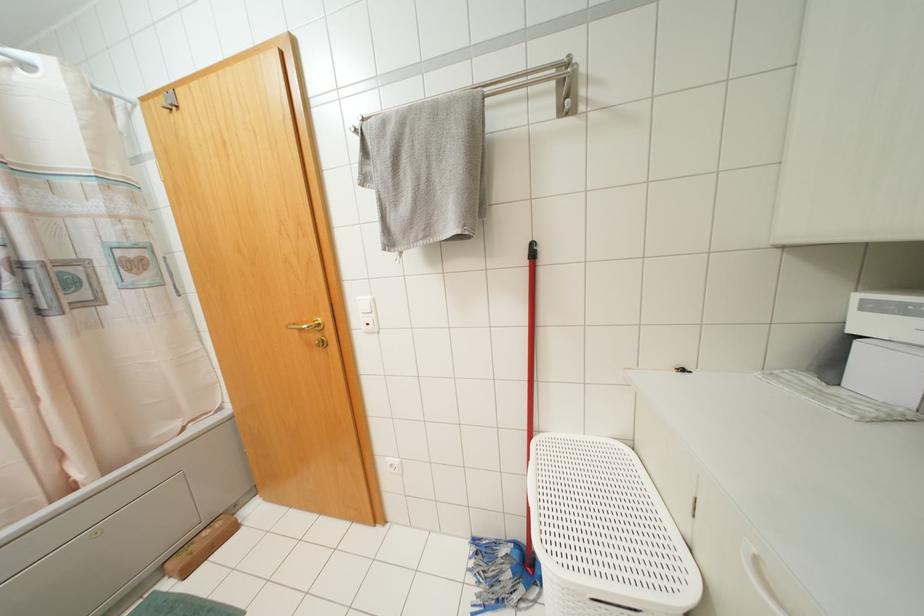
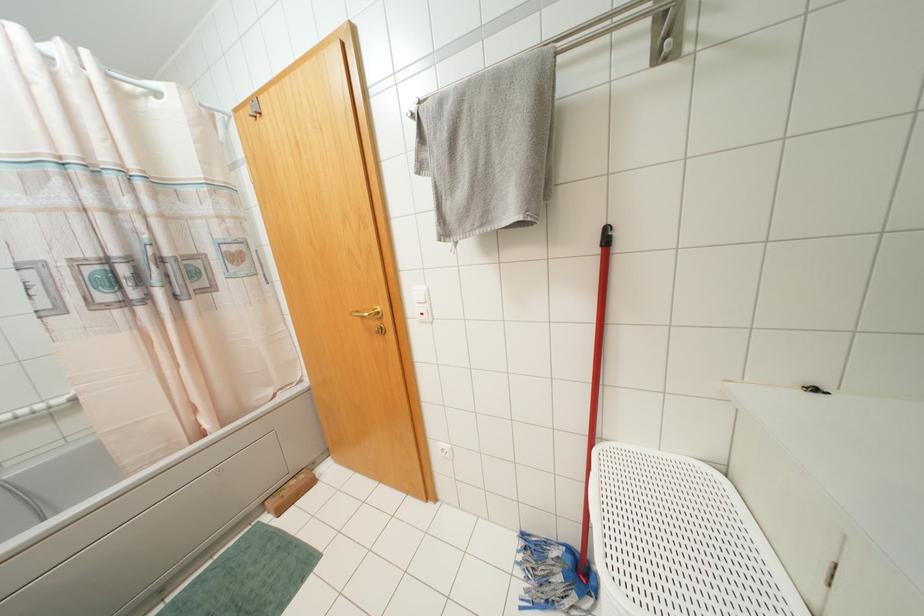
Locate, in the second image, the point that corresponds to pixel 531 245 in the first image.

(606, 229)